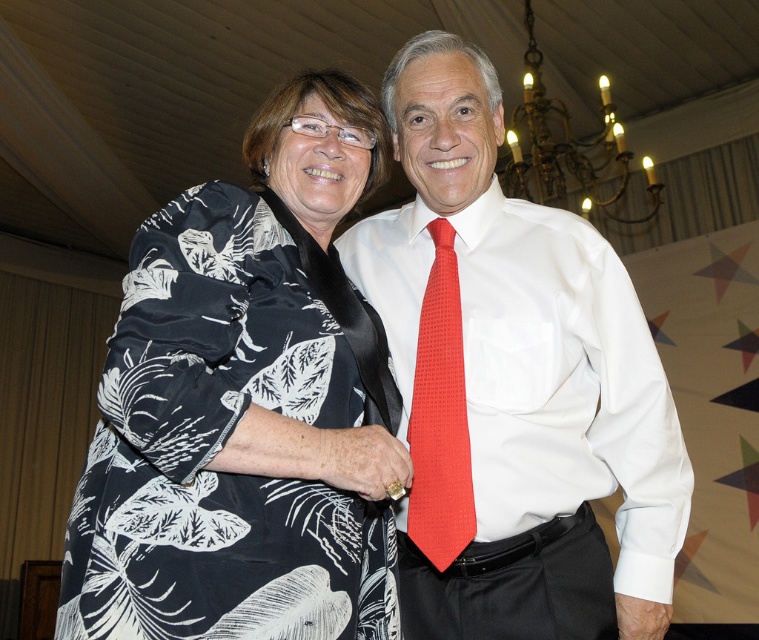
Question: Which of the following is the closest to the observer?

Choices:
 (A) red textured tie at center
 (B) black floral fabric dress at left
 (C) white smooth shirt at center

Answer: (B)

Question: Estimate the real-world distances between objects in this image. Which object is closer to the red textured tie at center?

Choices:
 (A) black floral fabric dress at left
 (B) white smooth shirt at center

Answer: (B)

Question: Can you confirm if white smooth shirt at center is positioned to the left of red textured tie at center?

Choices:
 (A) yes
 (B) no

Answer: (B)

Question: Which point appears farthest from the camera in this image?

Choices:
 (A) (567, 586)
 (B) (461, 368)

Answer: (B)

Question: Can you confirm if white smooth shirt at center is wider than red textured tie at center?

Choices:
 (A) no
 (B) yes

Answer: (B)

Question: Does black floral fabric dress at left appear on the left side of red textured tie at center?

Choices:
 (A) yes
 (B) no

Answer: (A)